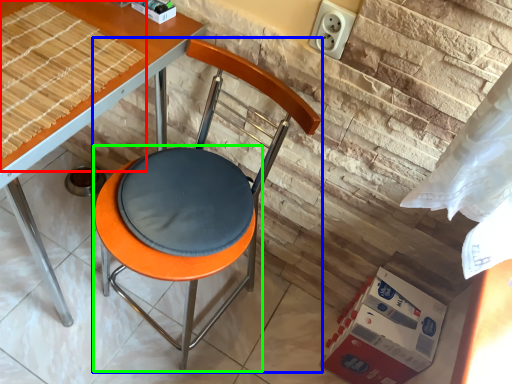
Question: Estimate the real-world distances between objects in this image. Which object is farther from mat (highlighted by a red box), chair (highlighted by a blue box) or bar stool (highlighted by a green box)?

Choices:
 (A) chair
 (B) bar stool

Answer: (B)